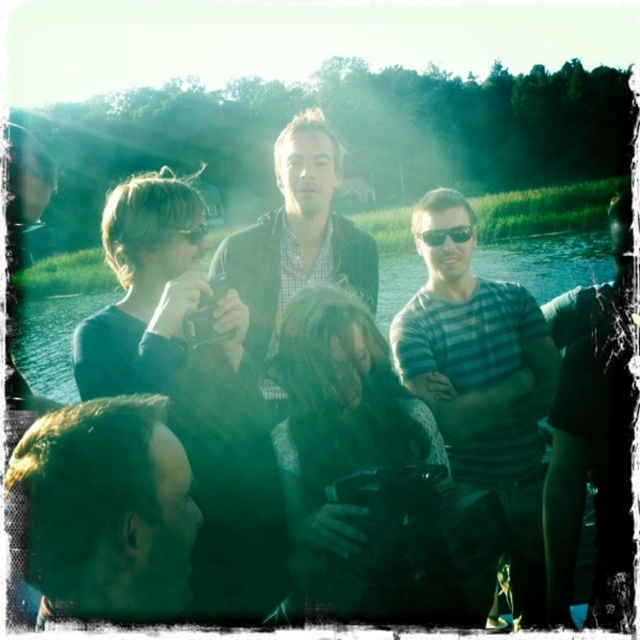
Between point (536, 330) and point (38, 305), which one is positioned in front?

Point (536, 330) is more forward.

Is point (470, 461) closer to viewer compared to point (580, 264)?

Yes.

Where is `striped cotton shirt at center`? striped cotton shirt at center is located at coordinates (483, 384).

Is the position of dark hair at center more distant than that of matte black jacket at center?

No, dark hair at center is closer to the viewer.

Measure the distance from dark hair at center to matte black jacket at center.

A distance of 1.48 meters exists between dark hair at center and matte black jacket at center.

Which is behind, point (138, 410) or point (364, 289)?

Positioned behind is point (364, 289).

Where is `dark hair at center`? This screenshot has height=640, width=640. dark hair at center is located at coordinates (106, 508).

Which of these two, striped cotton shirt at center or dark hair at center, stands shorter?

Standing shorter between the two is striped cotton shirt at center.

Is point (451, 259) positioned after point (128, 593)?

That is True.

Where is `striped cotton shirt at center`? This screenshot has height=640, width=640. striped cotton shirt at center is located at coordinates (483, 384).